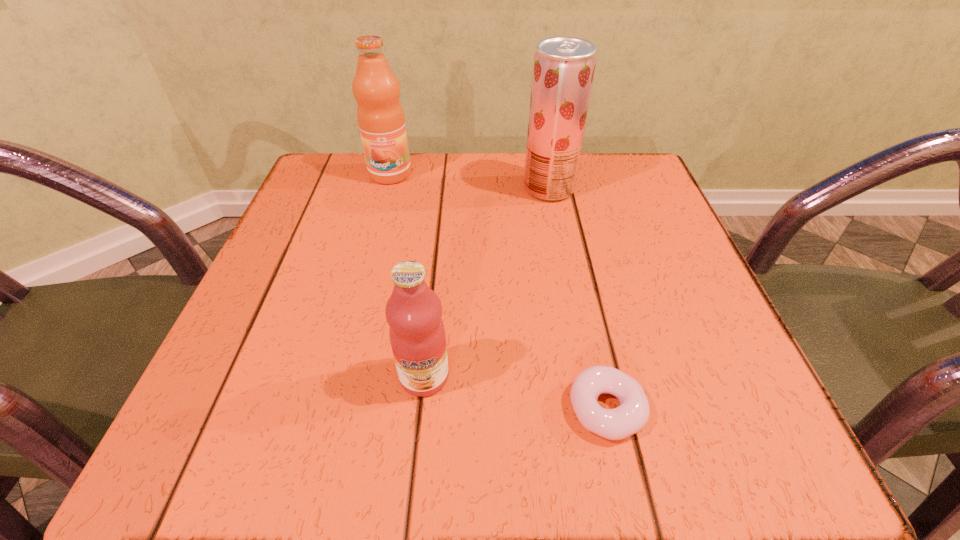
Locate an element on the screen. vacant area between the doughnut and the nearest fruit juice is located at coordinates (516, 393).

Image resolution: width=960 pixels, height=540 pixels. What are the coordinates of `vacant space that is in between the leftmost object and the doughnut` in the screenshot? It's located at (498, 292).

The width and height of the screenshot is (960, 540). In order to click on free space between the doughnut and the nearest fruit juice in this screenshot , I will do `click(516, 393)`.

Image resolution: width=960 pixels, height=540 pixels. Find the location of `free spot between the shortest object and the leftmost fruit juice`. free spot between the shortest object and the leftmost fruit juice is located at coordinates (498, 292).

The image size is (960, 540). Identify the location of free space between the second shortest object and the rightmost fruit juice. (487, 282).

Locate an element on the screen. This screenshot has height=540, width=960. vacant space in between the second object from left to right and the rightmost fruit juice is located at coordinates (487, 282).

The image size is (960, 540). I want to click on free space between the shortest object and the second object from left to right, so click(516, 393).

Image resolution: width=960 pixels, height=540 pixels. I want to click on free spot between the leftmost fruit juice and the rightmost fruit juice, so click(469, 181).

Locate an element on the screen. The image size is (960, 540). vacant area that lies between the rightmost fruit juice and the shortest fruit juice is located at coordinates (487, 282).

The height and width of the screenshot is (540, 960). What are the coordinates of `free area in between the rightmost fruit juice and the leftmost object` in the screenshot? It's located at pyautogui.click(x=469, y=181).